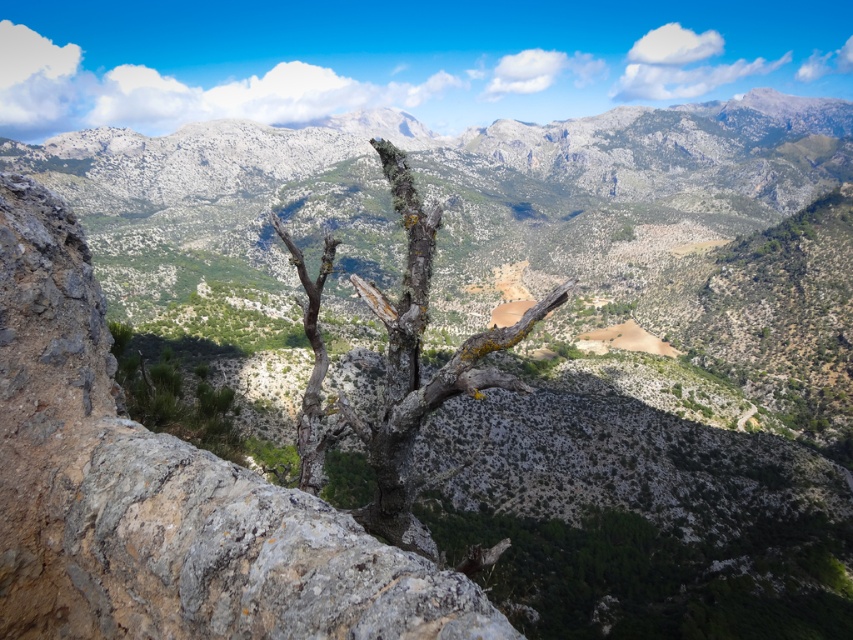
Question: Can you confirm if gray rough rock at center is bigger than gray rough bark tree at center?

Choices:
 (A) yes
 (B) no

Answer: (B)

Question: Can you confirm if gray rough rock at center is smaller than gray rocky mountain range at upper center?

Choices:
 (A) yes
 (B) no

Answer: (A)

Question: Does gray rough rock at center appear under gray rough bark tree at center?

Choices:
 (A) no
 (B) yes

Answer: (B)

Question: Which point is closer to the camera?

Choices:
 (A) gray rough rock at center
 (B) gray rocky mountain range at upper center
 (C) gray rough bark tree at center

Answer: (A)

Question: Among these objects, which one is farthest from the camera?

Choices:
 (A) gray rocky mountain range at upper center
 (B) gray rough bark tree at center
 (C) gray rough rock at center

Answer: (A)

Question: Among these points, which one is farthest from the camera?

Choices:
 (A) (44, 348)
 (B) (407, 260)

Answer: (B)